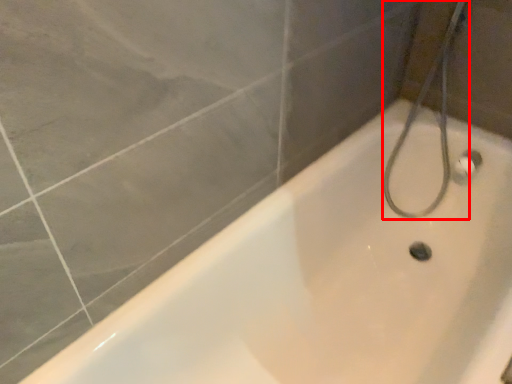
Question: Observing the image, what is the correct spatial positioning of shower (annotated by the red box) in reference to bathtub?

Choices:
 (A) left
 (B) right

Answer: (B)